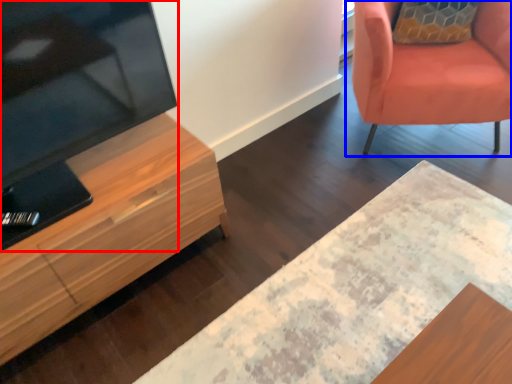
Question: Which object is closer to the camera taking this photo, television (highlighted by a red box) or chair (highlighted by a blue box)?

Choices:
 (A) television
 (B) chair

Answer: (A)